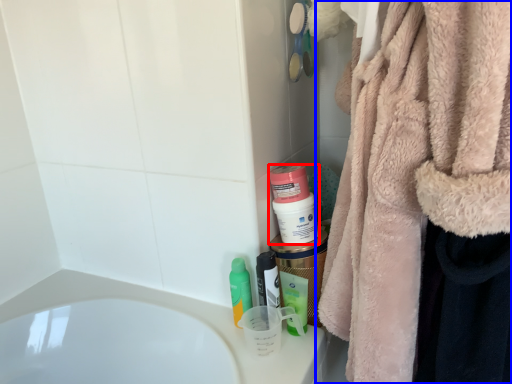
Question: Which object appears closest to the camera in this image, mouthwash (highlighted by a red box) or towel (highlighted by a blue box)?

Choices:
 (A) mouthwash
 (B) towel

Answer: (B)